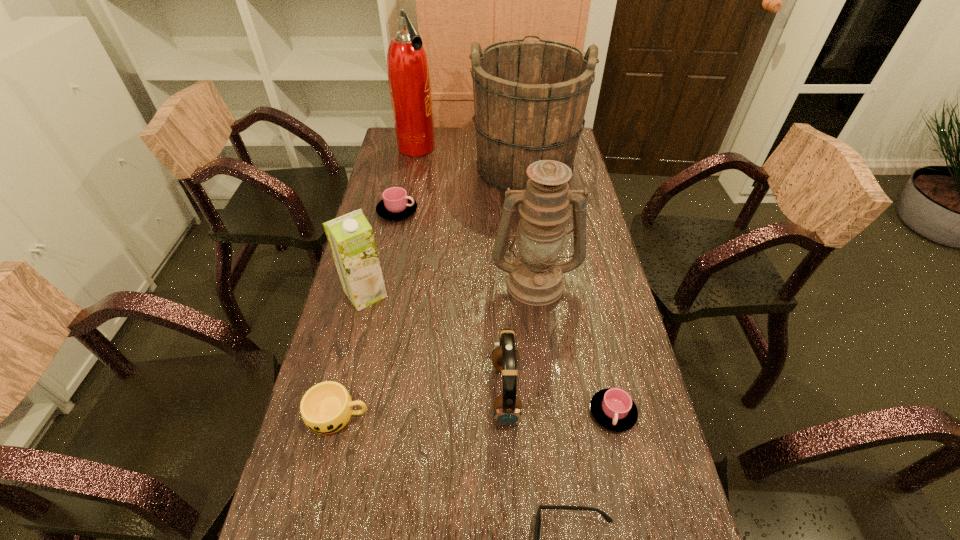
This screenshot has height=540, width=960. Find the location of `unoccupied area between the headset and the fire extinguisher`. unoccupied area between the headset and the fire extinguisher is located at coordinates (461, 271).

The width and height of the screenshot is (960, 540). I want to click on unoccupied position between the red fire extinguisher and the soya milk, so click(391, 221).

Identify the location of the fifth closest object relative to the nearer pink cup. Image resolution: width=960 pixels, height=540 pixels. (351, 239).

Select which object is the fifth closest to the bucket. Please provide its 2D coordinates. Your answer should be formatted as a tuple, i.e. [(x, y)], where the tuple contains the x and y coordinates of a point satisfying the conditions above.

[(507, 407)]

Find the location of `cup that is the second closest to the beige cup`. cup that is the second closest to the beige cup is located at coordinates (396, 205).

This screenshot has width=960, height=540. I want to click on cup object that ranks as the closest to the farther pink cup, so click(326, 408).

Where is `vacant region that satisfies the following two spatial constraints: 1. on the side with the handle of the bigger pink cup; 2. on the left side of the oil lamp`? The width and height of the screenshot is (960, 540). vacant region that satisfies the following two spatial constraints: 1. on the side with the handle of the bigger pink cup; 2. on the left side of the oil lamp is located at coordinates (382, 281).

Identify the location of vacant space that satisfies the following two spatial constraints: 1. on the back side of the bucket; 2. on the right side of the beige cup. The width and height of the screenshot is (960, 540). (397, 165).